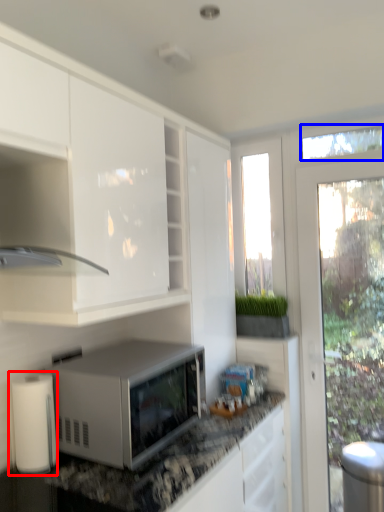
Question: Which point is further to the camera, paper towel (highlighted by a red box) or window screen (highlighted by a blue box)?

Choices:
 (A) paper towel
 (B) window screen

Answer: (B)